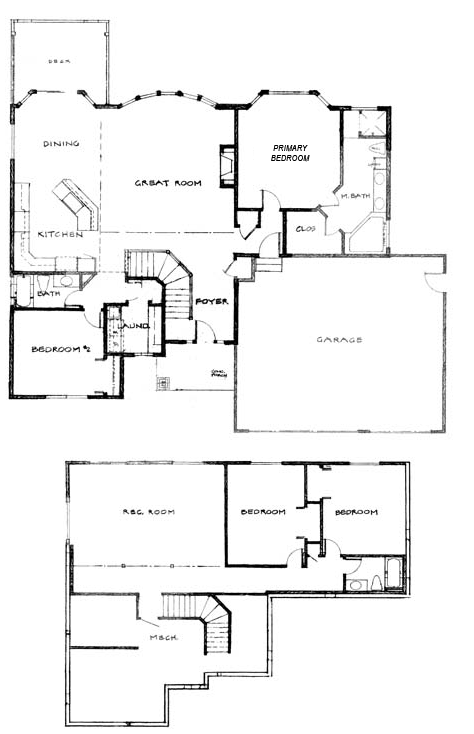
Where is `floor plan`? The height and width of the screenshot is (734, 474). floor plan is located at coordinates (203, 425).